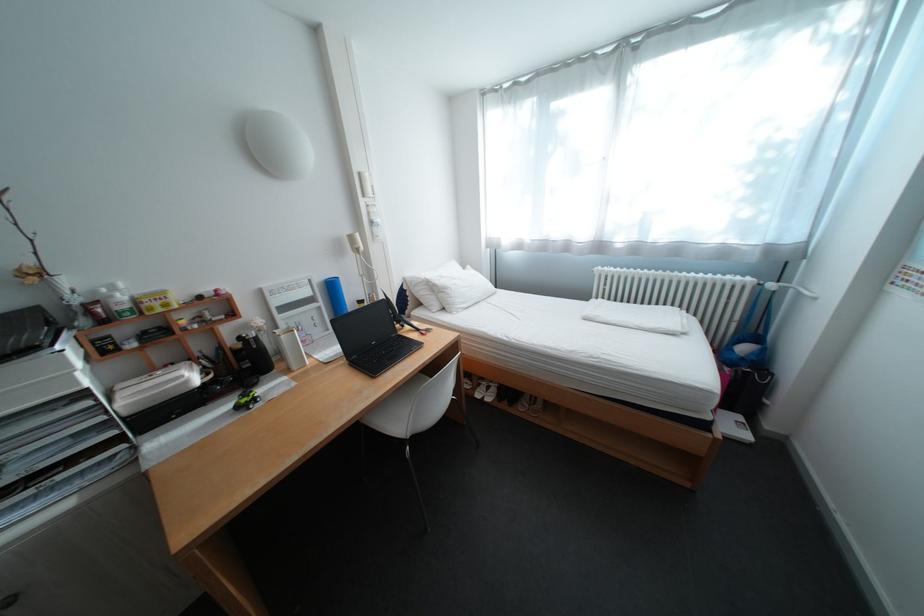
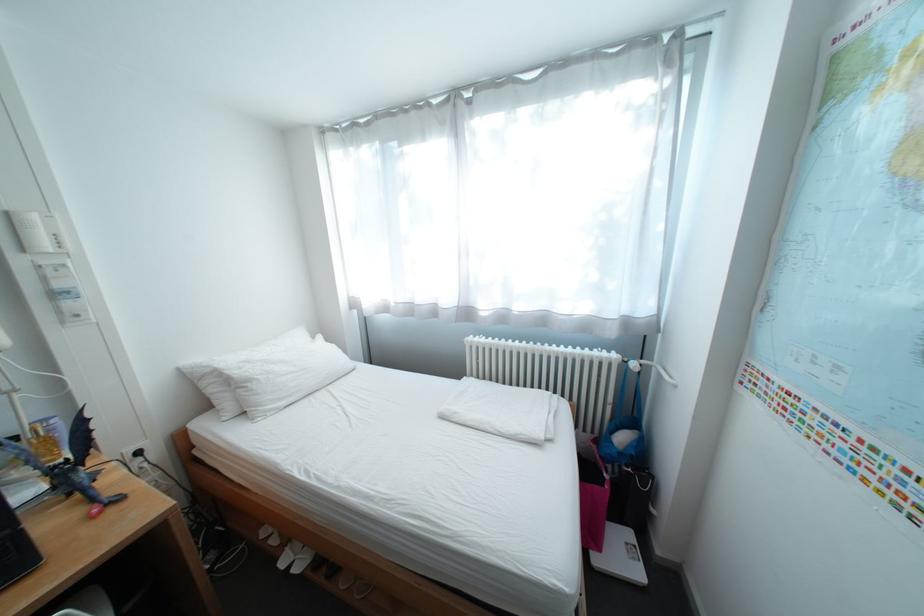
Locate, in the second image, the point that corresponds to point (746, 424) in the first image.

(637, 548)